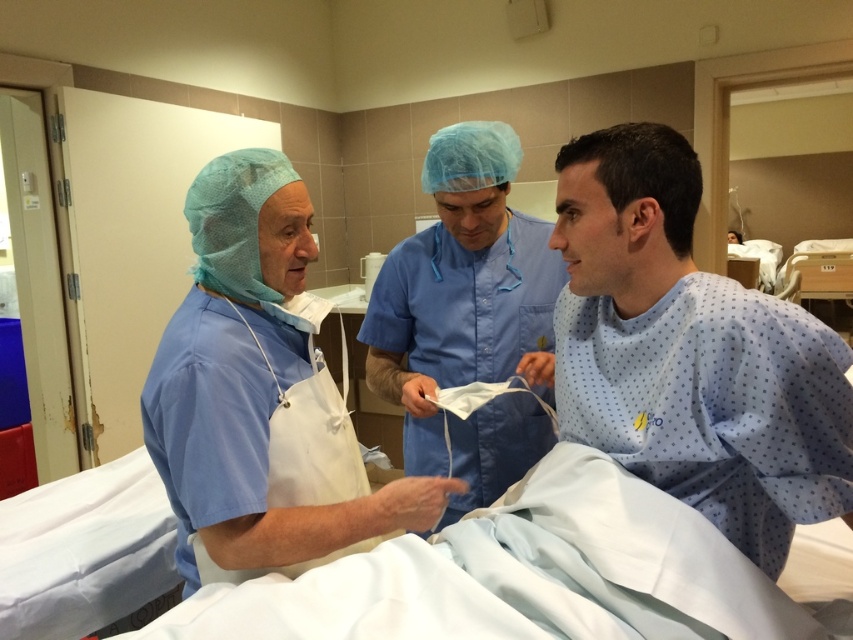
Between light blue fabric at center and white fabric hospital bed at center, which one appears on the left side from the viewer's perspective?

white fabric hospital bed at center is more to the left.

Is light blue fabric at center bigger than white fabric hospital bed at center?

Correct, light blue fabric at center is larger in size than white fabric hospital bed at center.

Is point (653, 148) behind point (579, 467)?

No.

Identify the location of light blue fabric at center. (689, 353).

Is point (817, 433) closer to camera compared to point (199, 582)?

That is True.

Is light blue fabric at center behind blue smooth scrubs at left?

No, light blue fabric at center is closer to the viewer.

Which is behind, point (793, 492) or point (277, 150)?

Positioned behind is point (277, 150).

You are a GUI agent. You are given a task and a screenshot of the screen. Output one action in this format:
    pyautogui.click(x=<x>, y=<y>)
    Task: Click on the light blue fabric at center
    
    Given the screenshot: What is the action you would take?
    pyautogui.click(x=689, y=353)

Who is shorter, white fabric hospital bed at center or blue smooth scrubs at center?

white fabric hospital bed at center

Who is lower down, white fabric hospital bed at center or blue smooth scrubs at center?

white fabric hospital bed at center is lower down.

Identify the location of white fabric hospital bed at center. (521, 573).